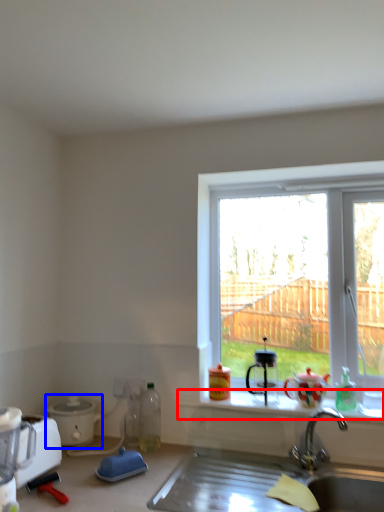
Question: Which point is further to the camera, window sill (highlighted by a red box) or appliance (highlighted by a blue box)?

Choices:
 (A) window sill
 (B) appliance

Answer: (B)